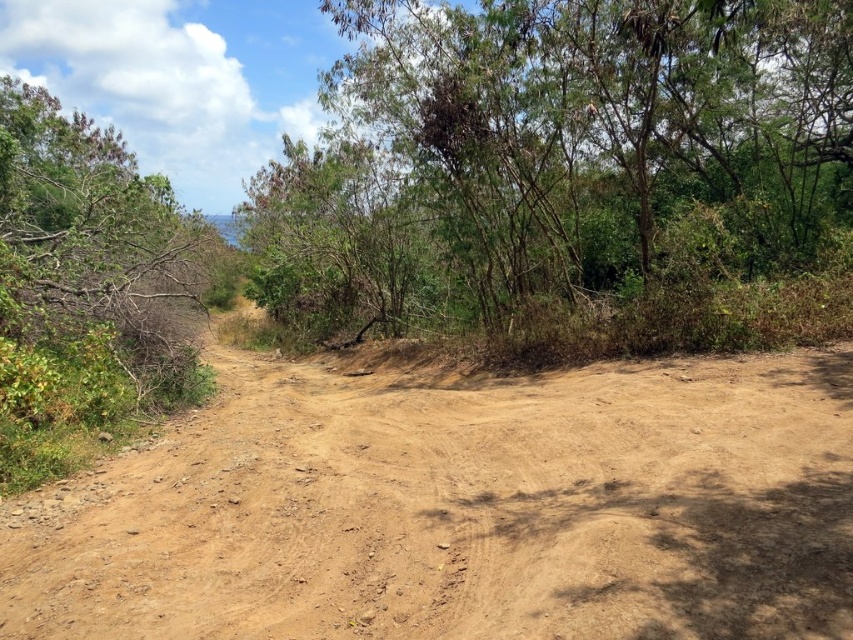
You are standing at the starting point of the dirt path and want to walk to the end of the path. Which direction should you head relative to the brown sandy dirt at center?

Since the dirt path curves gently to the left in the distance, you should head in the direction of the curve, which would be to the left relative to the brown sandy dirt at center.